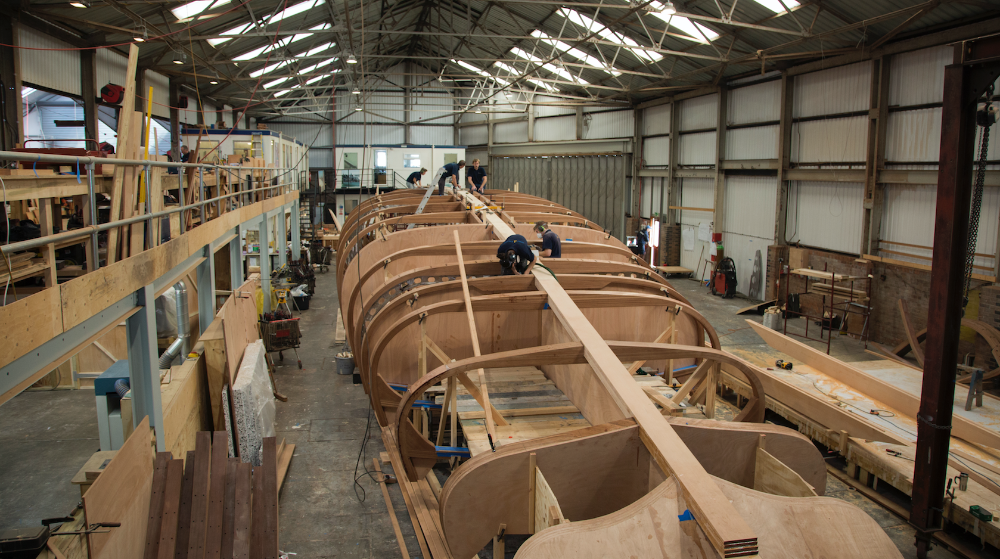
At what (x,y) coordinates should I click in order to perform the action: click on bucket. Please return your answer as a coordinate pair (x, y). This screenshot has width=1000, height=559. Looking at the image, I should click on (342, 364).